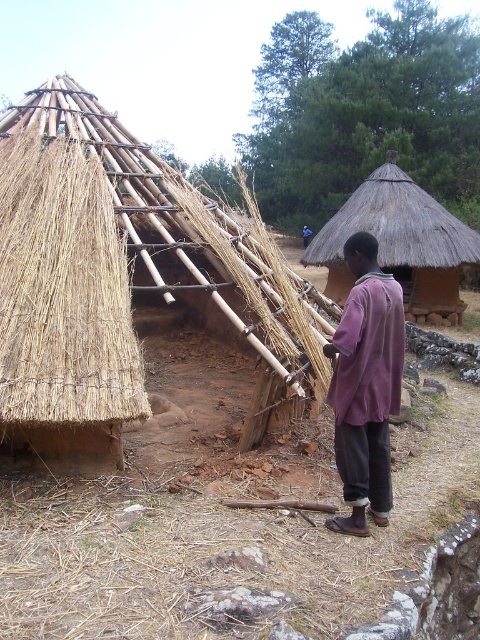
Who is lower down, purple cotton shirt at center or thatched straw roof at upper right?

purple cotton shirt at center is lower down.

Find the location of `purple cotton shirt at center`. purple cotton shirt at center is located at coordinates (365, 385).

Is point (368, 420) farther from camera compared to point (455, 253)?

No.

This screenshot has width=480, height=640. Identify the location of purple cotton shirt at center. (365, 385).

Can you confirm if brown thatch hut at left is shorter than thatched straw roof at upper right?

Yes, brown thatch hut at left is shorter than thatched straw roof at upper right.

Is brown thatch hut at left to the right of thatched straw roof at upper right from the viewer's perspective?

No, brown thatch hut at left is not to the right of thatched straw roof at upper right.

Which is in front, point (11, 115) or point (440, 227)?

Point (11, 115) is more forward.

At what (x,y) coordinates should I click in order to perform the action: click on brown thatch hut at left. Please return your answer as a coordinate pair (x, y). The height and width of the screenshot is (640, 480). Looking at the image, I should click on (111, 278).

Is brown thatch hut at left thinner than natural straw thatch at upper left?

Yes.

Is brown thatch hut at left shorter than natural straw thatch at upper left?

Yes.

Between point (52, 97) and point (132, 412), which one is positioned behind?

Positioned behind is point (52, 97).

In order to click on brown thatch hut at left in this screenshot , I will do `click(111, 278)`.